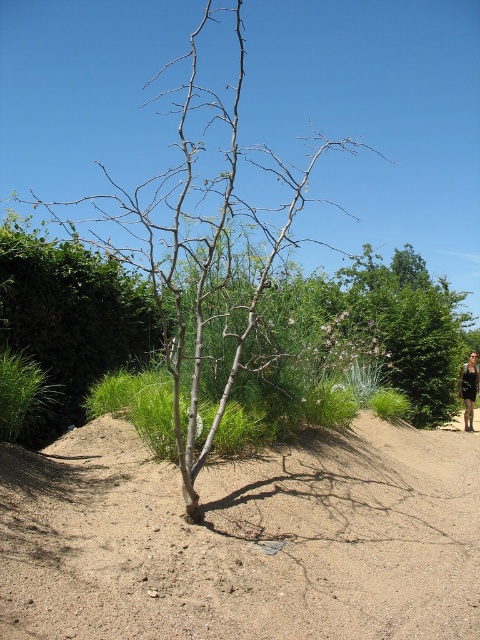
Question: Which object is the farthest from the bare wood tree at center?

Choices:
 (A) brown sandy soil at center
 (B) black leather dress at lower right

Answer: (B)

Question: Does brown sandy soil at center have a lesser width compared to black leather dress at lower right?

Choices:
 (A) yes
 (B) no

Answer: (B)

Question: Is bare wood tree at center positioned behind black leather dress at lower right?

Choices:
 (A) yes
 (B) no

Answer: (B)

Question: Which object is the farthest from the bare wood tree at center?

Choices:
 (A) brown sandy soil at center
 (B) black leather dress at lower right

Answer: (B)

Question: Does brown sandy soil at center appear on the right side of bare wood tree at center?

Choices:
 (A) yes
 (B) no

Answer: (A)

Question: Which object is positioned farthest from the brown sandy soil at center?

Choices:
 (A) bare wood tree at center
 (B) black leather dress at lower right

Answer: (B)